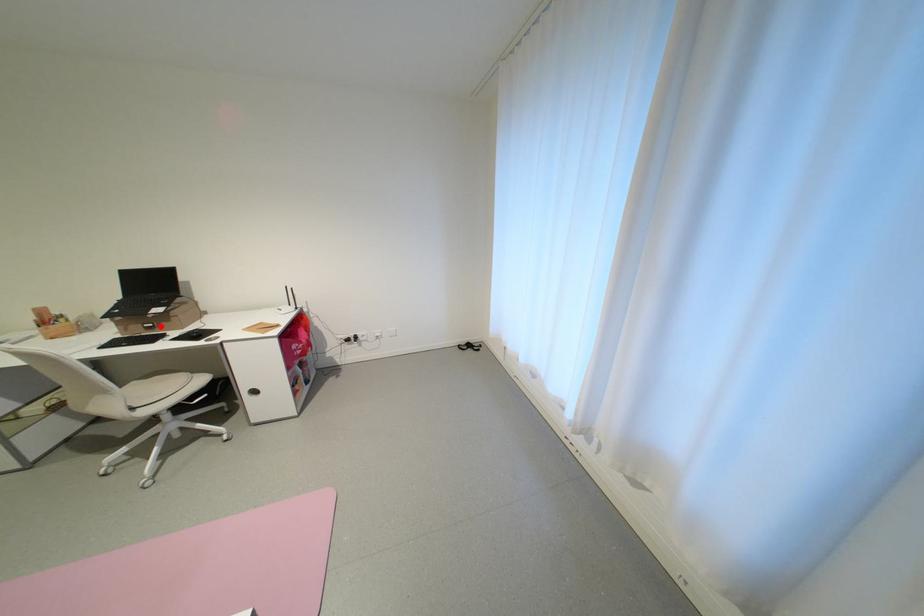
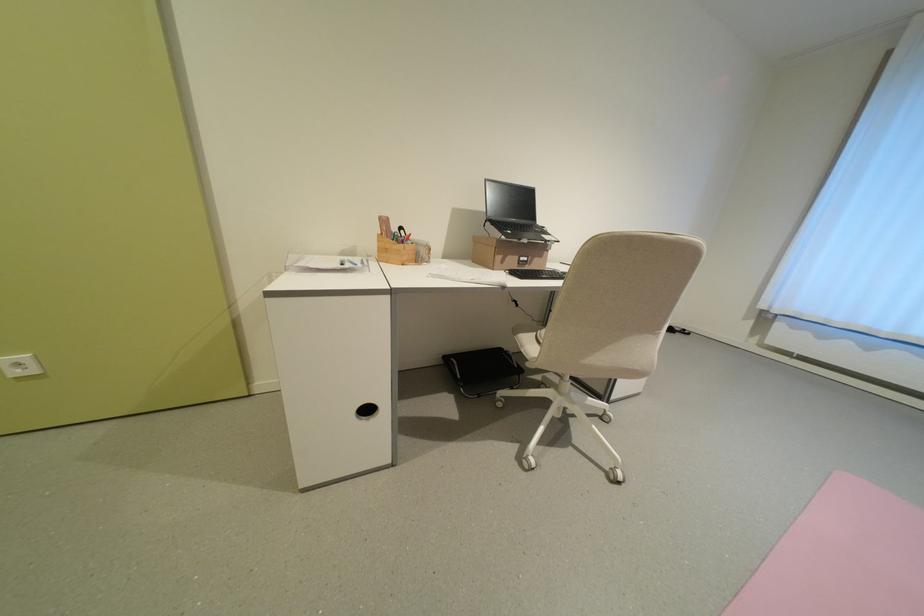
The point at the highlighted location is marked in the first image. Where is the corresponding point in the second image?

(536, 261)